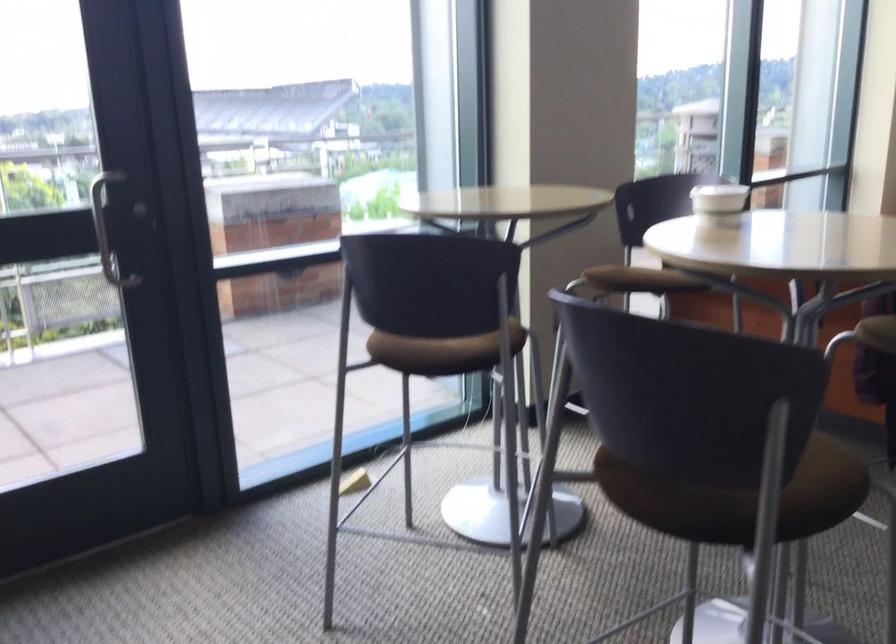
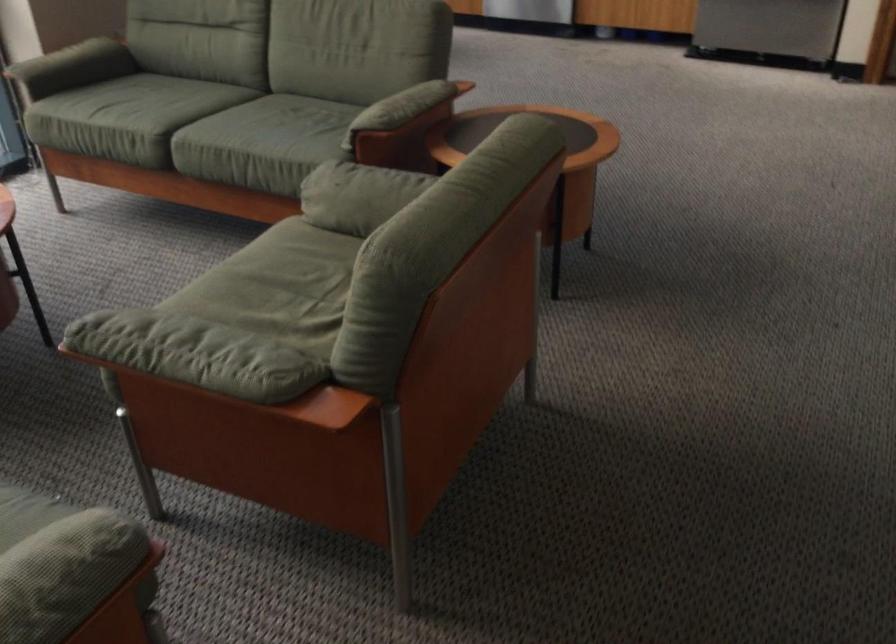
In a continuous first-person perspective shot, in which direction is the camera moving?

The cameraman walked toward right, forward.